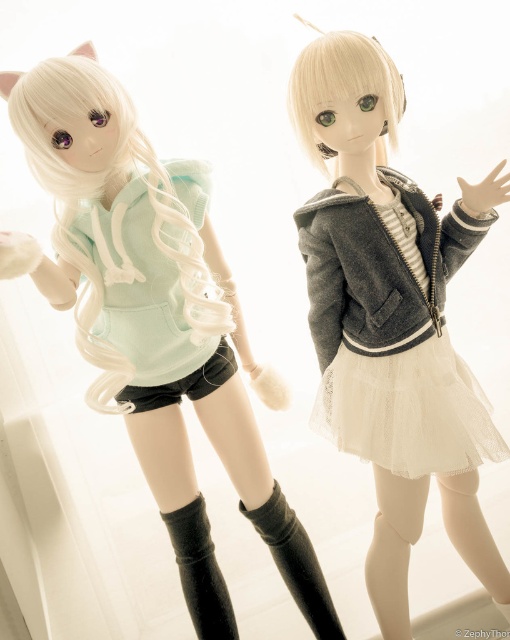
You are a collector who wants to display both the matte black hoodie at left and the black suede boot at lower center on a shelf. The shelf has limited space, and you need to know which item takes up more space. Based on the image, which object is bigger?

The matte black hoodie at left is larger in size than the black suede boot at lower center, so the matte black hoodie at left takes up more space and requires more shelf space.

Looking at this image, you are a customer at a toy store looking to buy a doll. You want to know which item is taller between the matte black hoodie at left and the black knitted boot at lower center. Can you tell me which one is taller?

The matte black hoodie at left is much taller than the black knitted boot at lower center.

You are a customer at a toy store looking to buy a pair of socks for the doll. The store has a policy that the socks must be taller than any footwear item the doll is wearing. Based on the image, can the black matte sock at lower center be used with the black suede boot at lower center?

The black suede boot at lower center is much taller than the black matte sock at lower center, so the socks would not meet the store policy requirement of being taller than the footwear. Therefore, the black matte sock at lower center cannot be used with the black suede boot at lower center.